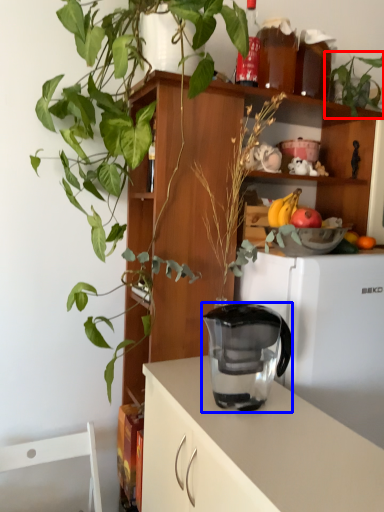
Question: Which point is closer to the camera, houseplant (highlighted by a red box) or jug (highlighted by a blue box)?

Choices:
 (A) houseplant
 (B) jug

Answer: (B)